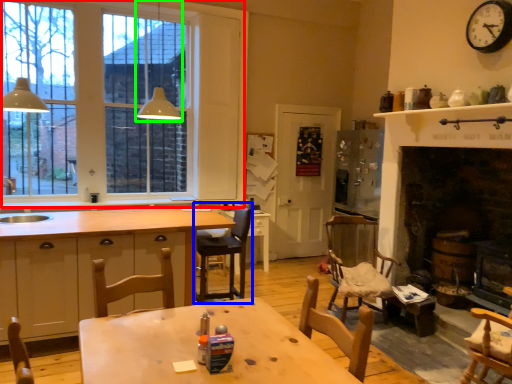
Question: Based on their relative distances, which object is nearer to window (highlighted by a red box)? Choose from chair (highlighted by a blue box) and light fixture (highlighted by a green box).

Choices:
 (A) chair
 (B) light fixture

Answer: (B)